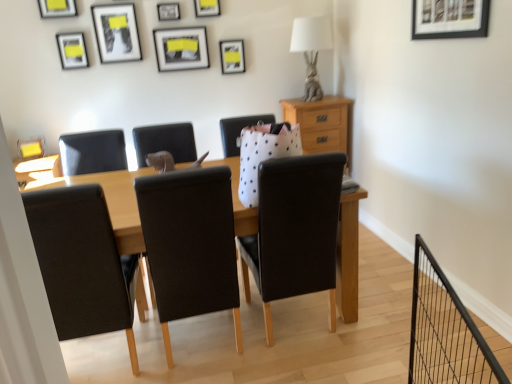
Question: Looking at their shapes, would you say light brown wood at upper right is wider or thinner than matte black picture frame at upper center, the 2th picture frame in the back-to-front sequence?

Choices:
 (A) thin
 (B) wide

Answer: (B)

Question: In the image, is light brown wood at upper right on the left side or the right side of matte black picture frame at upper center, which appears as the eighth picture frame when viewed from the front?

Choices:
 (A) left
 (B) right

Answer: (B)

Question: Which of these objects is positioned closest to the white fabric lamp at upper center?

Choices:
 (A) metallic silver picture frame at upper center, which is the fifth picture frame from right to left
 (B) brushed metal picture frame at upper left, the fifth picture frame when ordered from back to front
 (C) matte black picture frame at upper center, which appears as the eighth picture frame when viewed from the front
 (D) matte black picture frame at upper center, the 1th picture frame in the back-to-front sequence
 (E) metallic silver picture frame at upper left, which appears as the 2th picture frame when viewed from the left

Answer: (D)

Question: Considering the real-world distances, which object is farthest from the metallic silver picture frame at upper center, which is the fourth picture frame in back-to-front order?

Choices:
 (A) matte black picture frame at upper center, which is the 6th picture frame from left to right
 (B) matte black picture frame at upper center, positioned as the ninth picture frame in front-to-back order
 (C) matte black picture frame at upper left, arranged as the fourth picture frame when viewed from the front
 (D) white fabric lamp at upper center
 (E) matte black picture frame at upper center, marked as the 4th picture frame in a left-to-right arrangement

Answer: (D)